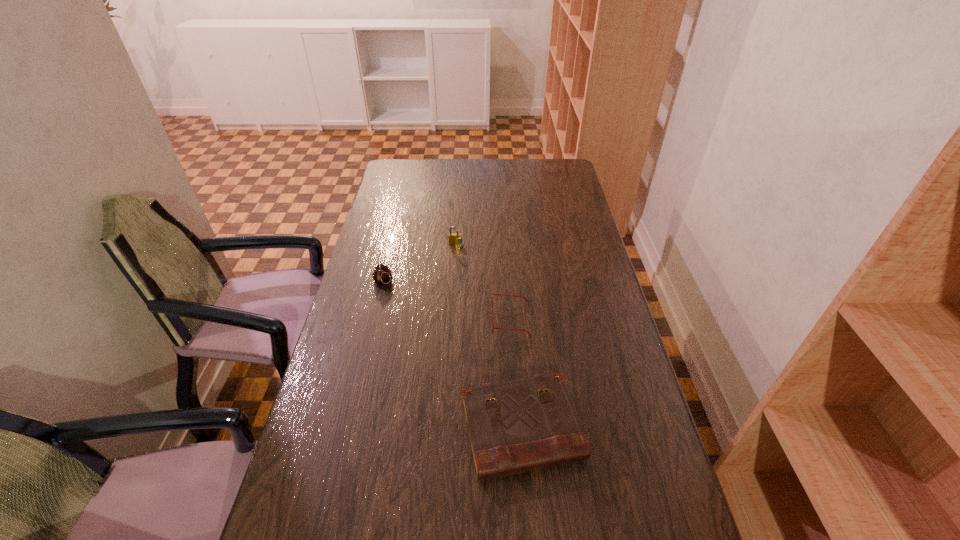
The width and height of the screenshot is (960, 540). What are the coordinates of `the third object from right to left` in the screenshot? It's located at (454, 238).

At what (x,y) coordinates should I click in order to perform the action: click on the farthest object. Please return your answer as a coordinate pair (x, y). The image size is (960, 540). Looking at the image, I should click on (454, 238).

Locate an element on the screen. The image size is (960, 540). pinecone is located at coordinates (382, 275).

I want to click on the leftmost object, so click(x=382, y=275).

The height and width of the screenshot is (540, 960). What are the coordinates of `hardback book` in the screenshot? It's located at (522, 425).

This screenshot has width=960, height=540. I want to click on the shortest object, so click(492, 294).

The height and width of the screenshot is (540, 960). Find the location of `the second nearest object`. the second nearest object is located at coordinates (492, 294).

This screenshot has height=540, width=960. Identify the location of vacant space situated 0.340m on the side with the combination dials of the third object from right to left. (451, 314).

This screenshot has height=540, width=960. Identify the location of free region located with a leaf charm attached to the leftmost object. (373, 319).

This screenshot has height=540, width=960. I want to click on free region located on the left of the hardback book, so click(361, 430).